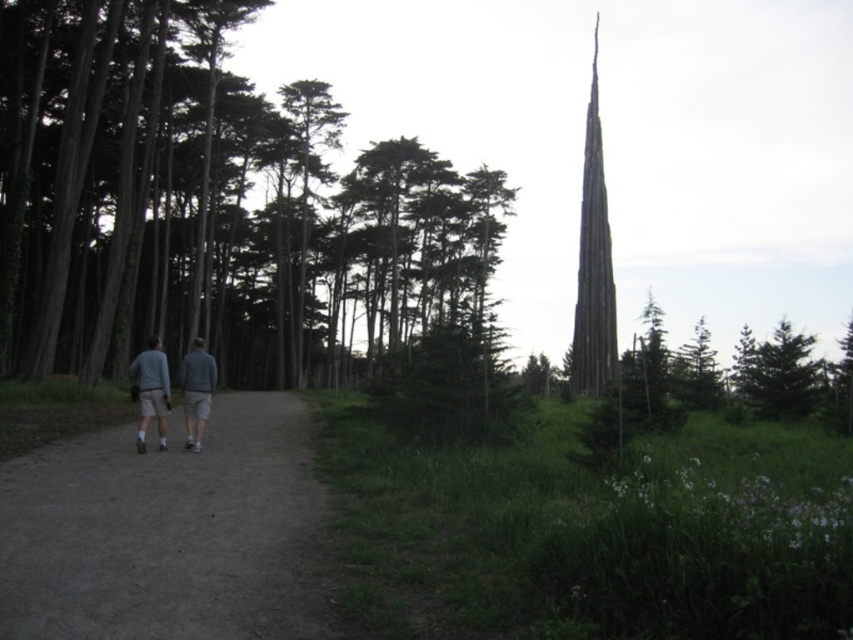
You are standing at the starting point of the dirt path in the forest. You see two points marked on the path. The first point is at coordinate point (x=590, y=296) and the second point is at coordinate point (x=184, y=371). If you walk forward along the path, which point will you encounter first?

You will encounter point (x=184, y=371) first because point (x=590, y=296) is behind it along the path.

You are a hiker planning to take a photo of the smooth gray spire at upper right and the gray fabric shorts at left. Which object should you focus on first if you want to capture both in a single frame without moving the camera?

You should focus on the smooth gray spire at upper right first because it is wider than the gray fabric shorts at left, so it will require more space in the frame.